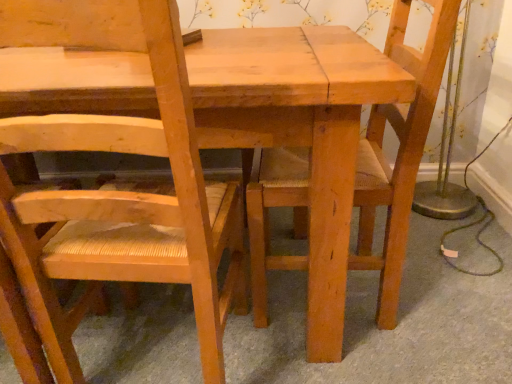
Question: Considering the positions of point (396, 127) and point (46, 3), is point (396, 127) closer or farther from the camera than point (46, 3)?

Choices:
 (A) closer
 (B) farther

Answer: (B)

Question: Based on their sizes in the image, would you say natural wood chair at center, which ranks as the 1th chair in right-to-left order, is bigger or smaller than natural wood chair at left, the 1th chair when ordered from left to right?

Choices:
 (A) small
 (B) big

Answer: (B)

Question: In the image, is natural wood chair at center, arranged as the 2th chair when viewed from the left, positioned in front of or behind natural wood chair at left, acting as the 2th chair starting from the right?

Choices:
 (A) behind
 (B) front

Answer: (A)

Question: Considering the relative positions of natural wood chair at left, acting as the 2th chair starting from the right, and natural wood chair at center, which ranks as the 1th chair in right-to-left order, in the image provided, is natural wood chair at left, acting as the 2th chair starting from the right, to the left or to the right of natural wood chair at center, which ranks as the 1th chair in right-to-left order,?

Choices:
 (A) left
 (B) right

Answer: (A)

Question: Looking at their shapes, would you say natural wood chair at left, acting as the 2th chair starting from the right, is wider or thinner than natural wood chair at center, which ranks as the 1th chair in right-to-left order?

Choices:
 (A) thin
 (B) wide

Answer: (A)

Question: Considering the positions of natural wood chair at left, the 1th chair when ordered from left to right, and natural wood chair at center, which ranks as the 1th chair in right-to-left order, in the image, is natural wood chair at left, the 1th chair when ordered from left to right, bigger or smaller than natural wood chair at center, which ranks as the 1th chair in right-to-left order,?

Choices:
 (A) big
 (B) small

Answer: (B)

Question: From the image's perspective, is natural wood chair at left, the 1th chair when ordered from left to right, above or below natural wood chair at center, arranged as the 2th chair when viewed from the left?

Choices:
 (A) below
 (B) above

Answer: (A)